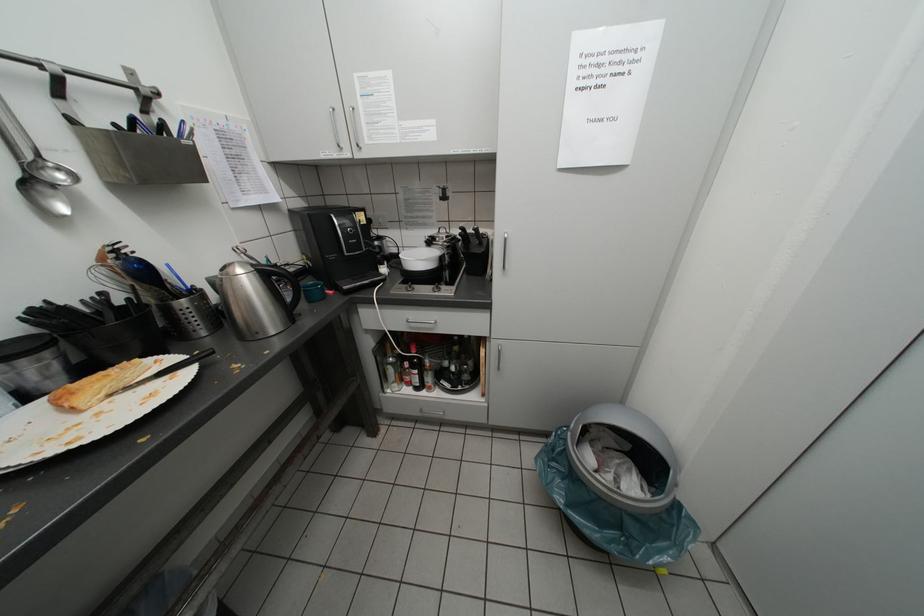
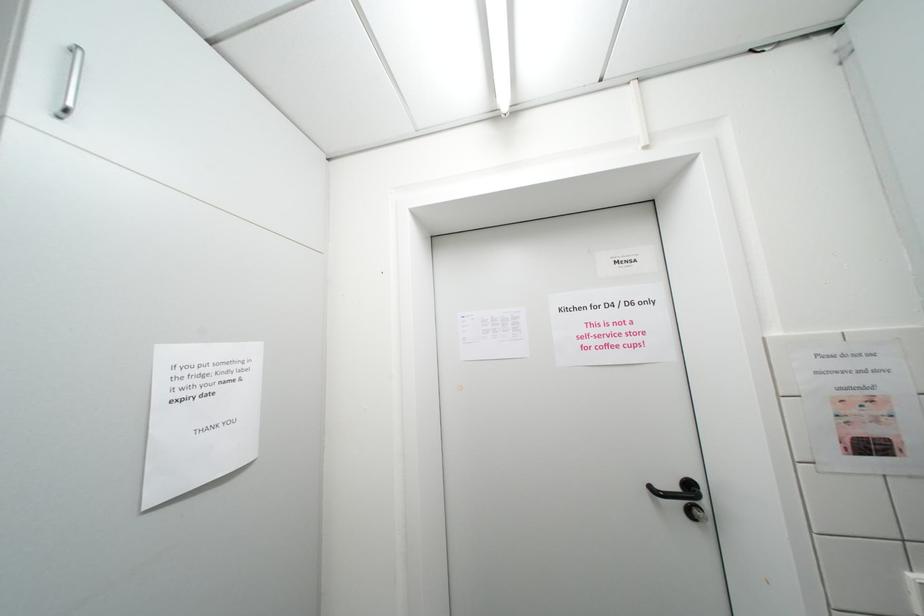
Question: The first image is from the beginning of the video and the second image is from the end. How did the camera likely rotate when shooting the video?

Choices:
 (A) Left
 (B) Right
 (C) Up
 (D) Down

Answer: (B)